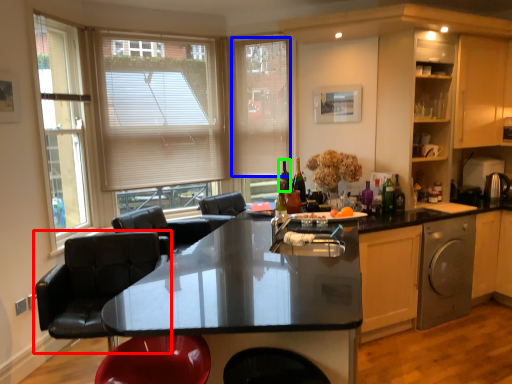
Question: Which is farther away from chair (highlighted by a red box)? blind (highlighted by a blue box) or wine bottle (highlighted by a green box)?

Choices:
 (A) blind
 (B) wine bottle

Answer: (A)